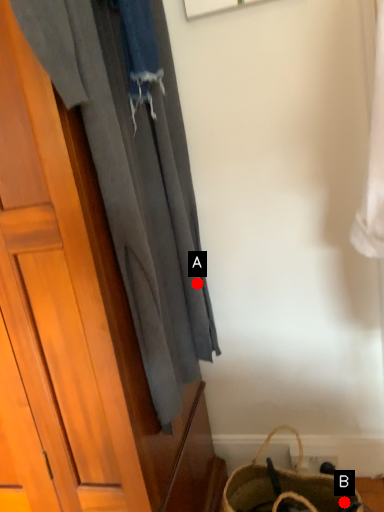
Question: Two points are circled on the image, labeled by A and B beside each circle. Which point is closer to the camera?

Choices:
 (A) A is closer
 (B) B is closer

Answer: (A)